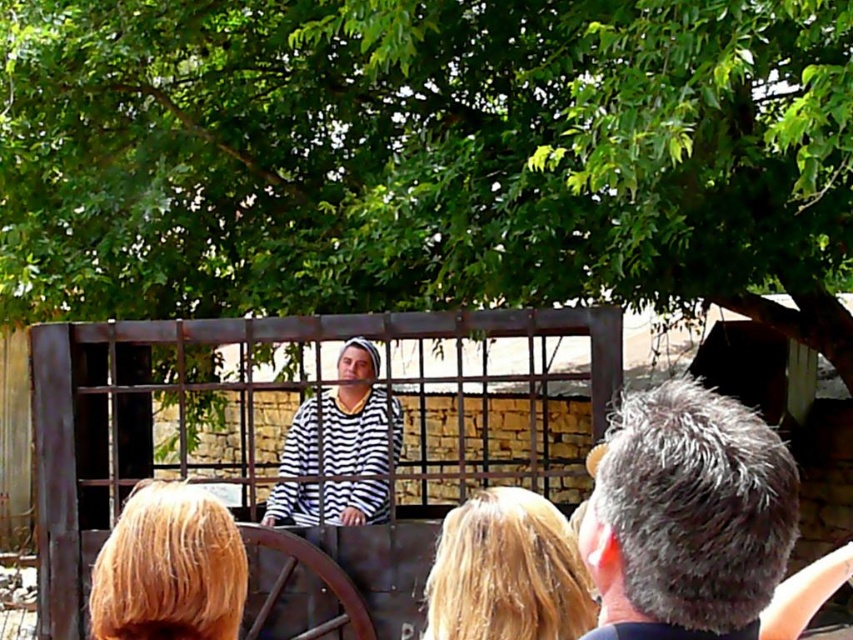
Question: Is rusty metal cage at center smaller than blonde hair at center?

Choices:
 (A) no
 (B) yes

Answer: (B)

Question: Which object is positioned farthest from the gray matte hair at upper right?

Choices:
 (A) striped fabric shirt at center
 (B) rusty metal cage at center
 (C) blonde hair at lower left
 (D) blonde hair at center

Answer: (B)

Question: Considering the real-world distances, which object is farthest from the gray matte hair at upper right?

Choices:
 (A) rusty metal cage at center
 (B) blonde hair at lower left
 (C) striped fabric shirt at center
 (D) blonde hair at center

Answer: (A)

Question: Which point is farther from the camera taking this photo?

Choices:
 (A) (259, 490)
 (B) (828, 580)
 (C) (325, 486)
 (D) (572, 620)

Answer: (A)

Question: Does gray matte hair at upper right appear on the left side of blonde hair at center?

Choices:
 (A) yes
 (B) no

Answer: (B)

Question: Can you confirm if rusty metal cage at center is positioned to the right of blonde hair at lower left?

Choices:
 (A) no
 (B) yes

Answer: (A)